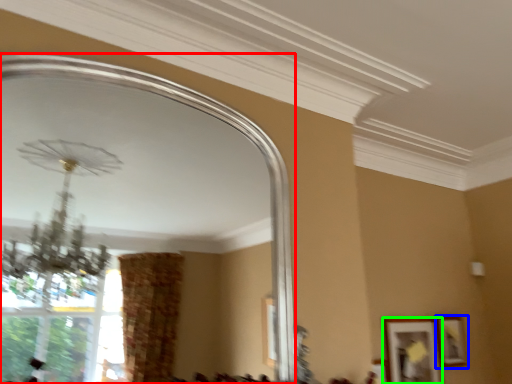
Question: Considering the real-world distances, which object is farthest from mirror (highlighted by a red box)? picture frame (highlighted by a blue box) or picture frame (highlighted by a green box)?

Choices:
 (A) picture frame
 (B) picture frame

Answer: (A)